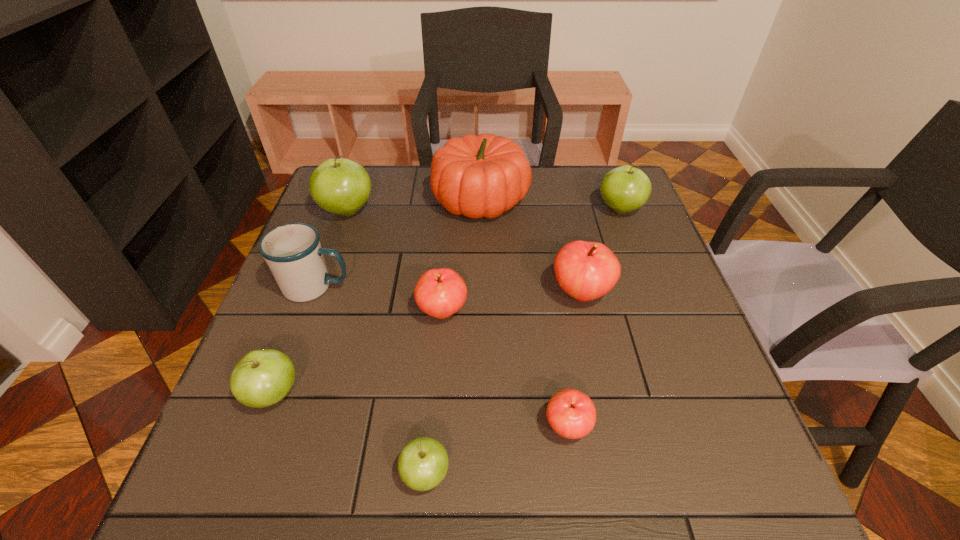
You are a GUI agent. You are given a task and a screenshot of the screen. Output one action in this format:
    pyautogui.click(x=<x>, y=<y>)
    Task: Click on the object that stands as the seventh closest to the biggest red apple
    This screenshot has width=960, height=540.
    Given the screenshot: What is the action you would take?
    pyautogui.click(x=340, y=186)

Identify which apple is located as the third nearest to the smallest red apple. Please provide its 2D coordinates. Your answer should be formatted as a tuple, i.e. [(x, y)], where the tuple contains the x and y coordinates of a point satisfying the conditions above.

[(441, 292)]

Locate which apple is the third closest to the nearest green apple. Please provide its 2D coordinates. Your answer should be formatted as a tuple, i.e. [(x, y)], where the tuple contains the x and y coordinates of a point satisfying the conditions above.

[(441, 292)]

Locate an element on the screen. Image resolution: width=960 pixels, height=540 pixels. the closest green apple to the pumpkin is located at coordinates (340, 186).

Locate which green apple ranks in proximity to the nearest green apple. Please provide its 2D coordinates. Your answer should be formatted as a tuple, i.e. [(x, y)], where the tuple contains the x and y coordinates of a point satisfying the conditions above.

[(262, 378)]

Point out which red apple is positioned as the second nearest to the mug. Please provide its 2D coordinates. Your answer should be formatted as a tuple, i.e. [(x, y)], where the tuple contains the x and y coordinates of a point satisfying the conditions above.

[(585, 270)]

Image resolution: width=960 pixels, height=540 pixels. I want to click on red apple that is the third closest to the rightmost green apple, so click(x=571, y=413).

The height and width of the screenshot is (540, 960). What are the coordinates of `vacant space that satisfies the following two spatial constraints: 1. on the handle side of the mug; 2. on the left side of the nearest red apple` in the screenshot? It's located at (266, 427).

This screenshot has width=960, height=540. Identify the location of vacant region that satisfies the following two spatial constraints: 1. on the front side of the smallest red apple; 2. on the right side of the second smallest red apple. click(x=433, y=427).

The width and height of the screenshot is (960, 540). Find the location of `free spot that satisfies the following two spatial constraints: 1. on the front side of the biggest red apple; 2. on the left side of the pumpkin`. free spot that satisfies the following two spatial constraints: 1. on the front side of the biggest red apple; 2. on the left side of the pumpkin is located at coordinates (481, 293).